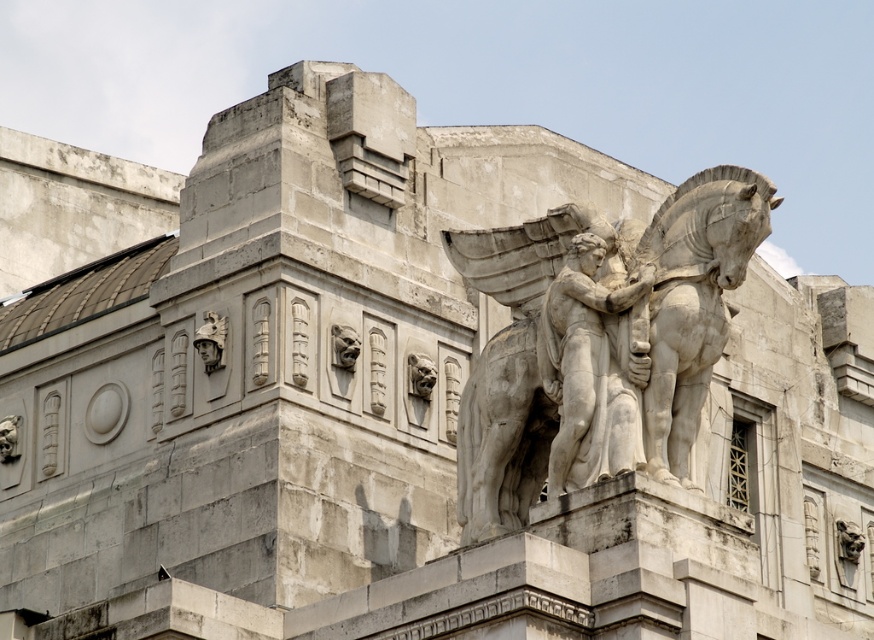
You are an art conservator assessing the structural integrity of the white marble statue at upper right and the white marble angel at center. From your vantage point, which object appears closer to you?

The white marble statue at upper right is in front of the white marble angel at center, so it appears closer to you.

You are an architect planning to install a new light fixture between the white marble statue at upper right and the white marble angel at center. The light fixture requires a minimum of 10 feet of space to avoid obstruction. Based on the distance between them, can you safely install the light fixture without violating this requirement?

The white marble statue at upper right is 8.78 feet away from the white marble angel at center. Since the required minimum space is 10 feet, the distance is insufficient, so the light fixture cannot be installed without violating the requirement.